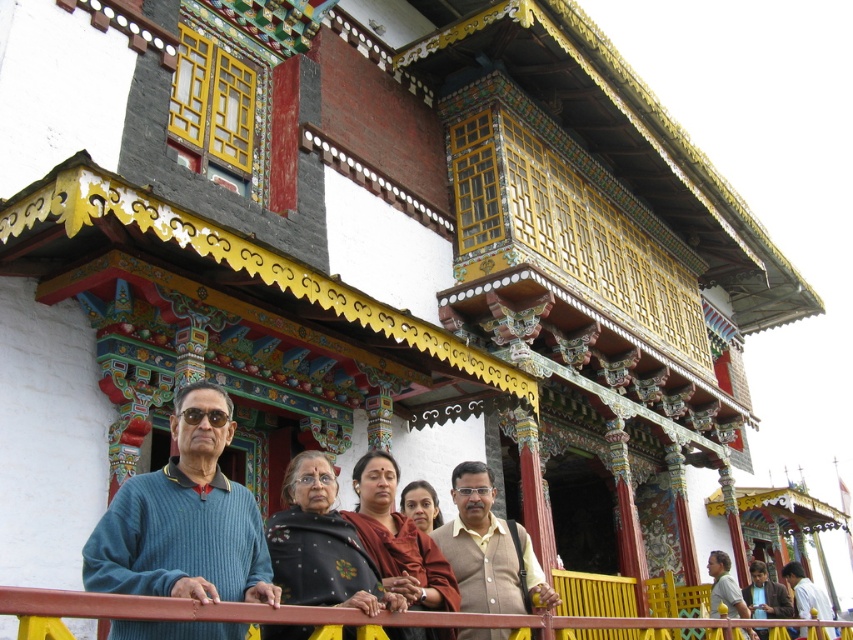
Question: Among these points, which one is farthest from the camera?

Choices:
 (A) (216, 580)
 (B) (460, 573)
 (C) (776, 600)

Answer: (C)

Question: Can you confirm if brown textured sweater at center is positioned to the right of light brown fabric shirt at center?

Choices:
 (A) yes
 (B) no

Answer: (B)

Question: Is brown leather jacket at center bigger than light brown fabric shirt at center?

Choices:
 (A) yes
 (B) no

Answer: (B)

Question: Does teal sweater at left have a larger size compared to light brown fabric shirt at center?

Choices:
 (A) no
 (B) yes

Answer: (A)

Question: Which point is farther to the camera?

Choices:
 (A) light brown fabric shirt at center
 (B) brown textured sweater at center
 (C) teal sweater at left
 (D) brown leather jacket at center

Answer: (D)

Question: Which object is closer to the camera taking this photo?

Choices:
 (A) brown textured sweater at center
 (B) brown leather jacket at center
 (C) light brown fabric shirt at center
 (D) teal sweater at left

Answer: (D)